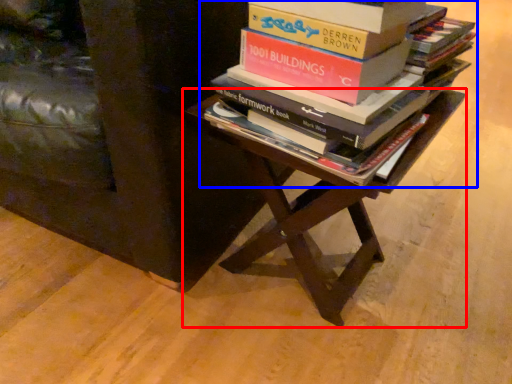
Question: Which of the following is the closest to the observer, table (highlighted by a red box) or book (highlighted by a blue box)?

Choices:
 (A) table
 (B) book

Answer: (B)